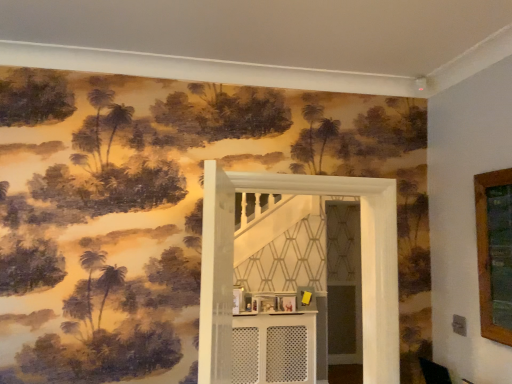
What do you see at coordinates (274, 348) in the screenshot? I see `white perforated table at center` at bounding box center [274, 348].

This screenshot has height=384, width=512. I want to click on white perforated table at center, so click(274, 348).

What do you see at coordinates (361, 265) in the screenshot? I see `white textured door at center` at bounding box center [361, 265].

Identify the location of white textured door at center. (361, 265).

You are a GUI agent. You are given a task and a screenshot of the screen. Output one action in this format:
    pyautogui.click(x=<x>, y=<y>)
    Task: Click on the white perforated table at center
    This screenshot has height=384, width=512.
    Given the screenshot: What is the action you would take?
    pyautogui.click(x=274, y=348)

Does white textured door at center appear on the right side of white perforated table at center?

Yes, white textured door at center is to the right of white perforated table at center.

Is white textured door at center in front of white perforated table at center?

Yes, the depth of white textured door at center is less than that of white perforated table at center.

Is point (206, 229) positioned behind point (289, 360)?

That is False.

Consider the image. From the image's perspective, which is below, white textured door at center or white perforated table at center?

white perforated table at center.

From a real-world perspective, who is located higher, white textured door at center or white perforated table at center?

white textured door at center is physically above.

Does white textured door at center have a lesser width compared to white perforated table at center?

No, white textured door at center is not thinner than white perforated table at center.

Considering the relative sizes of white textured door at center and white perforated table at center in the image provided, is white textured door at center taller than white perforated table at center?

Indeed, white textured door at center has a greater height compared to white perforated table at center.

In the scene shown: Can you confirm if white textured door at center is smaller than white perforated table at center?

Incorrect, white textured door at center is not smaller in size than white perforated table at center.

Which is correct: white textured door at center is inside white perforated table at center, or outside of it?

white textured door at center is not enclosed by white perforated table at center.

Is white textured door at center placed right next to white perforated table at center?

No, white textured door at center is not in contact with white perforated table at center.

Is white textured door at center oriented away from white perforated table at center?

Yes, white perforated table at center is at the back of white textured door at center.

How distant is white textured door at center from white perforated table at center?

A distance of 8.24 feet exists between white textured door at center and white perforated table at center.

Image resolution: width=512 pixels, height=384 pixels. I want to click on table below the white textured door at center (from a real-world perspective), so click(x=274, y=348).

Which is more to the right, white perforated table at center or white textured door at center?

Positioned to the right is white textured door at center.

Considering the positions of objects white perforated table at center and white textured door at center in the image provided, who is behind, white perforated table at center or white textured door at center?

white perforated table at center is further away from the camera.

Is point (279, 346) more distant than point (392, 300)?

Yes, it is behind point (392, 300).

From the image's perspective, which is below, white perforated table at center or white textured door at center?

From the image's view, white perforated table at center is below.

From a real-world perspective, between white perforated table at center and white textured door at center, who is vertically higher?

From a 3D spatial view, white textured door at center is above.

Is white perforated table at center wider than white textured door at center?

No.

Is white perforated table at center taller or shorter than white textured door at center?

Clearly, white perforated table at center is shorter compared to white textured door at center.

Considering the sizes of white perforated table at center and white textured door at center in the image, is white perforated table at center bigger or smaller than white textured door at center?

In the image, white perforated table at center appears to be smaller than white textured door at center.

Which is correct: white perforated table at center is inside white textured door at center, or outside of it?

white perforated table at center cannot be found inside white textured door at center.

Can you see white perforated table at center touching white textured door at center?

They are not placed beside each other.

Is white perforated table at center facing away from white textured door at center?

No.

In order to click on table that is behind the white textured door at center in this screenshot , I will do `click(274, 348)`.

You are a GUI agent. You are given a task and a screenshot of the screen. Output one action in this format:
    pyautogui.click(x=<x>, y=<y>)
    Task: Click on the table on the left of white textured door at center
    This screenshot has height=384, width=512.
    Given the screenshot: What is the action you would take?
    pyautogui.click(x=274, y=348)

Where is `table below the white textured door at center (from the image's perspective)`? This screenshot has height=384, width=512. table below the white textured door at center (from the image's perspective) is located at coordinates (274, 348).